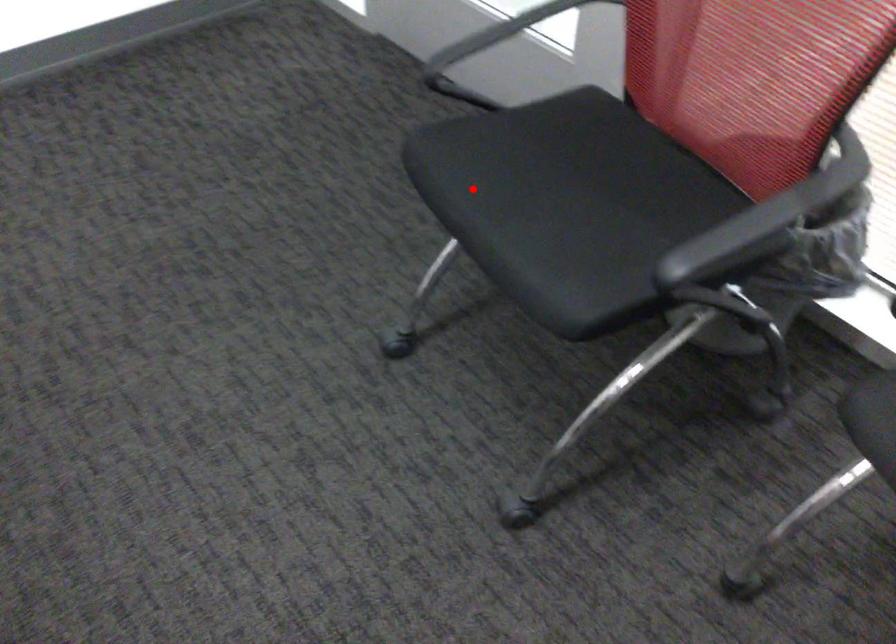
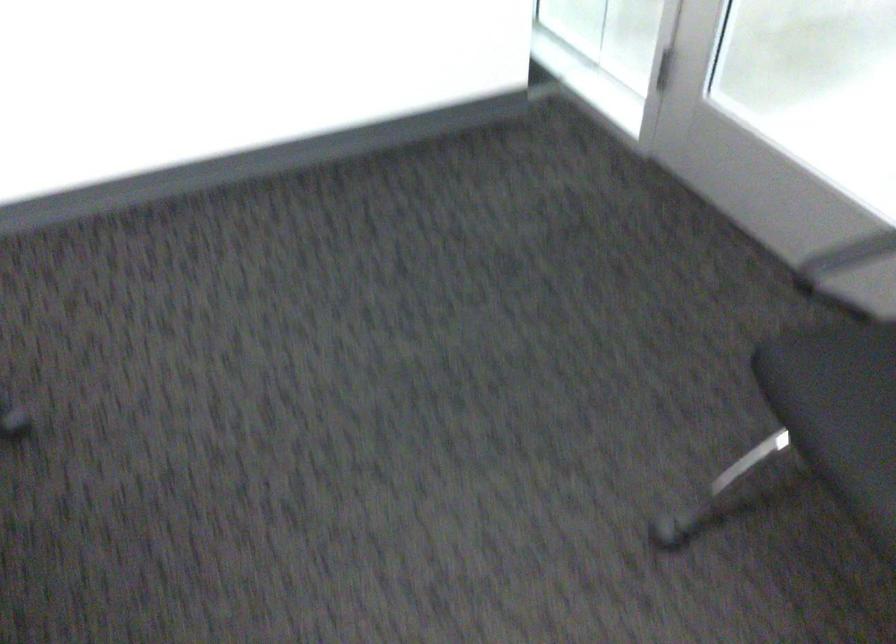
Question: I am providing you with two images of the same scene from different viewpoints. Image1 has a red point marked. In image2, the corresponding 3D location appears at what relative position? Reply with the corresponding letter.

Choices:
 (A) Closer
 (B) Farther

Answer: (A)